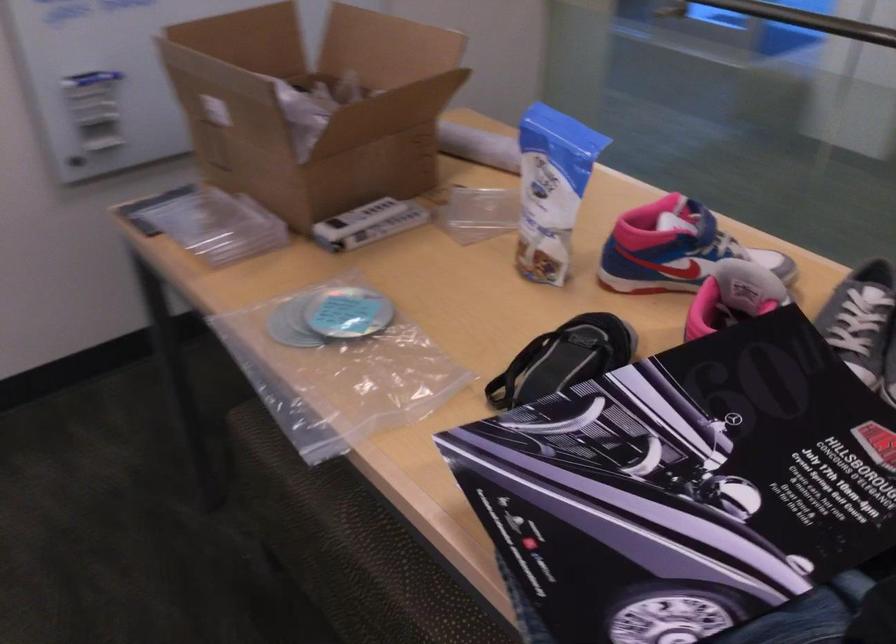
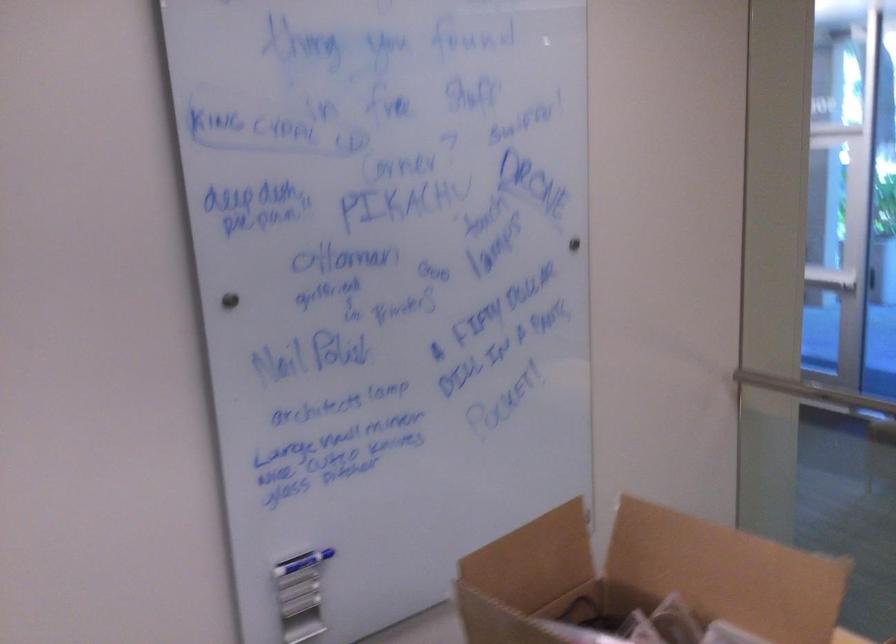
From the picture: In a continuous first-person perspective shot, in which direction is the camera moving?

The movement direction of the cameraman is left, forward.